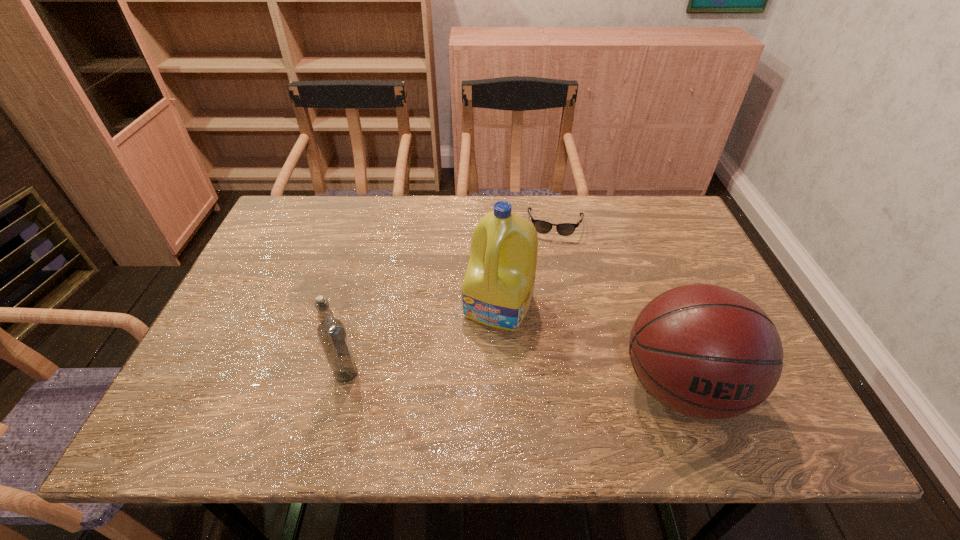
Locate an element on the screen. This screenshot has width=960, height=540. vacant area at the right edge is located at coordinates click(666, 246).

The width and height of the screenshot is (960, 540). In order to click on vacant space at the far left corner in this screenshot , I will do `click(335, 205)`.

This screenshot has height=540, width=960. Identify the location of free space at the far right corner of the desktop. (640, 214).

Locate an element on the screen. The height and width of the screenshot is (540, 960). free space between the detergent and the basketball is located at coordinates (590, 346).

The image size is (960, 540). What are the coordinates of `vacant space that's between the third nearest object and the leftmost object` in the screenshot? It's located at (422, 340).

Where is `blank region between the third nearest object and the basketball`? blank region between the third nearest object and the basketball is located at coordinates (590, 346).

Where is `blank region between the shortest object and the basketball`? blank region between the shortest object and the basketball is located at coordinates (618, 306).

You are a GUI agent. You are given a task and a screenshot of the screen. Output one action in this format:
    pyautogui.click(x=<x>, y=<y>)
    Task: Click on the free space between the sunglasses and the leftmost object
    The image size is (960, 540).
    Given the screenshot: What is the action you would take?
    pyautogui.click(x=451, y=299)

What are the coordinates of `empty space between the vodka and the basketball` in the screenshot? It's located at (514, 380).

Find the location of a particular element. vacant space that is in between the basketball and the shortest object is located at coordinates (618, 306).